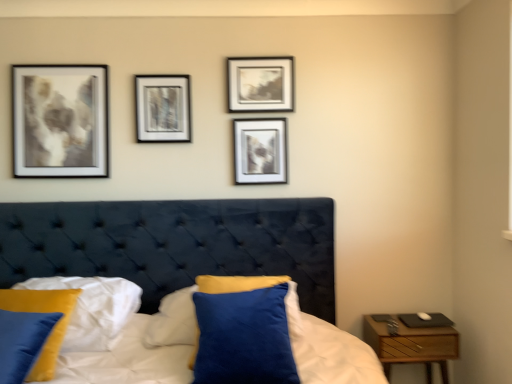
Where is `matte silver picture frame at upper center, marked as the 2th picture frame in a left-to-right arrangement`? matte silver picture frame at upper center, marked as the 2th picture frame in a left-to-right arrangement is located at coordinates (260, 151).

Measure the distance between velvet blue pillow at lower left, positioned as the first pillow in left-to-right order, and camera.

The distance of velvet blue pillow at lower left, positioned as the first pillow in left-to-right order, from camera is 1.52 meters.

You are a GUI agent. You are given a task and a screenshot of the screen. Output one action in this format:
    pyautogui.click(x=<x>, y=<y>)
    Task: Click on the matte silver picture frame at upper center, marked as the 2th picture frame in a left-to-right arrangement
    Image resolution: width=512 pixels, height=384 pixels.
    Given the screenshot: What is the action you would take?
    pyautogui.click(x=260, y=151)

Is point (141, 84) farther from camera compared to point (285, 101)?

No, (141, 84) is closer to viewer.

Is the position of metallic silver frame at center, the first picture frame when ordered from left to right, more distant than that of matte black picture frame at upper center, which is the 1th picture frame in right-to-left order?

No, metallic silver frame at center, the first picture frame when ordered from left to right, is in front of matte black picture frame at upper center, which is the 1th picture frame in right-to-left order.

Considering the relative positions of metallic silver frame at center, the 3th picture frame in the right-to-left sequence, and matte black picture frame at upper center, positioned as the 3th picture frame in left-to-right order, in the image provided, is metallic silver frame at center, the 3th picture frame in the right-to-left sequence, to the left of matte black picture frame at upper center, positioned as the 3th picture frame in left-to-right order, from the viewer's perspective?

Correct, you'll find metallic silver frame at center, the 3th picture frame in the right-to-left sequence, to the left of matte black picture frame at upper center, positioned as the 3th picture frame in left-to-right order.

Can you confirm if metallic silver frame at center, the first picture frame when ordered from left to right, is wider than matte black picture frame at upper center, which is the 1th picture frame in right-to-left order?

No, metallic silver frame at center, the first picture frame when ordered from left to right, is not wider than matte black picture frame at upper center, which is the 1th picture frame in right-to-left order.

Which is in front, point (159, 123) or point (402, 362)?

The point (402, 362) is closer.

Can we say metallic silver frame at center, the first picture frame when ordered from left to right, lies outside wooden nightstand at right?

metallic silver frame at center, the first picture frame when ordered from left to right, lies outside wooden nightstand at right's area.

From the image's perspective, would you say metallic silver frame at center, the 3th picture frame in the right-to-left sequence, is positioned over wooden nightstand at right?

Correct, metallic silver frame at center, the 3th picture frame in the right-to-left sequence, appears higher than wooden nightstand at right in the image.

Between metallic silver frame at center, the 3th picture frame in the right-to-left sequence, and wooden nightstand at right, which one has smaller width?

Thinner between the two is metallic silver frame at center, the 3th picture frame in the right-to-left sequence.

Is point (54, 290) behind point (269, 121)?

No, it is not.

Can you tell me how much velvet blue pillow at lower left, positioned as the first pillow in left-to-right order, and matte silver picture frame at upper center, the 2th picture frame positioned from the right, differ in facing direction?

There is a 2.05-degree angle between the facing directions of velvet blue pillow at lower left, positioned as the first pillow in left-to-right order, and matte silver picture frame at upper center, the 2th picture frame positioned from the right.

Who is smaller, velvet blue pillow at lower left, which appears as the 2th pillow when viewed from the right, or matte silver picture frame at upper center, marked as the 2th picture frame in a left-to-right arrangement?

matte silver picture frame at upper center, marked as the 2th picture frame in a left-to-right arrangement, is smaller.

Would you say velvet blue pillow at lower left, which appears as the 2th pillow when viewed from the right, is a long distance from matte silver picture frame at upper center, marked as the 2th picture frame in a left-to-right arrangement?

Yes.

Does matte black picture frame at upper center, which is the 1th picture frame in right-to-left order, have a greater width compared to wooden nightstand at right?

In fact, matte black picture frame at upper center, which is the 1th picture frame in right-to-left order, might be narrower than wooden nightstand at right.

Is matte black picture frame at upper center, positioned as the 3th picture frame in left-to-right order, at the right side of wooden nightstand at right?

No, matte black picture frame at upper center, positioned as the 3th picture frame in left-to-right order, is not to the right of wooden nightstand at right.

Image resolution: width=512 pixels, height=384 pixels. Find the location of `nightstand that is under the matte black picture frame at upper center, which is the 1th picture frame in right-to-left order (from a real-world perspective)`. nightstand that is under the matte black picture frame at upper center, which is the 1th picture frame in right-to-left order (from a real-world perspective) is located at coordinates (412, 345).

Is metallic silver frame at center, the 3th picture frame in the right-to-left sequence, facing away from matte silver picture frame at upper center, the 2th picture frame positioned from the right?

No.

Which object is positioned more to the right, metallic silver frame at center, the 3th picture frame in the right-to-left sequence, or matte silver picture frame at upper center, the 2th picture frame positioned from the right?

matte silver picture frame at upper center, the 2th picture frame positioned from the right.

Which object is further away from the camera taking this photo, metallic silver frame at center, the first picture frame when ordered from left to right, or matte silver picture frame at upper center, the 2th picture frame positioned from the right?

Positioned behind is matte silver picture frame at upper center, the 2th picture frame positioned from the right.

Is the position of matte black picture frame at upper center, which is the 1th picture frame in right-to-left order, less distant than that of matte silver picture frame at upper center, marked as the 2th picture frame in a left-to-right arrangement?

Yes, it is.

Does matte black picture frame at upper center, positioned as the 3th picture frame in left-to-right order, appear on the right side of matte silver picture frame at upper center, the 2th picture frame positioned from the right?

Correct, you'll find matte black picture frame at upper center, positioned as the 3th picture frame in left-to-right order, to the right of matte silver picture frame at upper center, the 2th picture frame positioned from the right.

In terms of width, does matte black picture frame at upper center, which is the 1th picture frame in right-to-left order, look wider or thinner when compared to matte silver picture frame at upper center, marked as the 2th picture frame in a left-to-right arrangement?

Clearly, matte black picture frame at upper center, which is the 1th picture frame in right-to-left order, has more width compared to matte silver picture frame at upper center, marked as the 2th picture frame in a left-to-right arrangement.

From a real-world perspective, is matte black picture frame at upper center, which is the 1th picture frame in right-to-left order, physically located above or below matte silver picture frame at upper center, the 2th picture frame positioned from the right?

matte black picture frame at upper center, which is the 1th picture frame in right-to-left order, is above matte silver picture frame at upper center, the 2th picture frame positioned from the right.

You are a GUI agent. You are given a task and a screenshot of the screen. Output one action in this format:
    pyautogui.click(x=<x>, y=<y>)
    Task: Click on the 1st picture frame directly above the velvet blue pillow at lower left, positioned as the first pillow in left-to-right order (from a real-world perspective)
    The image size is (512, 384).
    Given the screenshot: What is the action you would take?
    pyautogui.click(x=260, y=151)

Is matte silver picture frame at upper center, marked as the 2th picture frame in a left-to-right arrangement, far from velvet blue pillow at lower left, which appears as the 2th pillow when viewed from the right?

Yes, matte silver picture frame at upper center, marked as the 2th picture frame in a left-to-right arrangement, and velvet blue pillow at lower left, which appears as the 2th pillow when viewed from the right, are quite far apart.

Does matte silver picture frame at upper center, the 2th picture frame positioned from the right, lie behind velvet blue pillow at lower left, positioned as the first pillow in left-to-right order?

Yes.

Does point (246, 139) appear closer or farther from the camera than point (35, 293)?

Point (246, 139) appears to be farther away from the viewer than point (35, 293).

Where is `the 1st picture frame below the matte black picture frame at upper center, positioned as the 3th picture frame in left-to-right order (from the image's perspective)`? The image size is (512, 384). the 1st picture frame below the matte black picture frame at upper center, positioned as the 3th picture frame in left-to-right order (from the image's perspective) is located at coordinates (163, 108).

Where is `nightstand below the metallic silver frame at center, the 3th picture frame in the right-to-left sequence (from a real-world perspective)`? This screenshot has width=512, height=384. nightstand below the metallic silver frame at center, the 3th picture frame in the right-to-left sequence (from a real-world perspective) is located at coordinates (412, 345).

Estimate the real-world distances between objects in this image. Which object is further from matte silver picture frame at upper center, the 2th picture frame positioned from the right, matte black picture frame at upper center, positioned as the 3th picture frame in left-to-right order, or metallic silver frame at center, the 3th picture frame in the right-to-left sequence?

metallic silver frame at center, the 3th picture frame in the right-to-left sequence, is positioned further to the anchor matte silver picture frame at upper center, the 2th picture frame positioned from the right.

Considering their positions, is matte silver picture frame at upper center, the 2th picture frame positioned from the right, positioned closer to velvet blue pillow at lower left, which appears as the 2th pillow when viewed from the right, than metallic silver frame at center, the 3th picture frame in the right-to-left sequence?

metallic silver frame at center, the 3th picture frame in the right-to-left sequence.

From the image, which object appears to be farther from wooden nightstand at right, velvet blue pillow at lower left, which appears as the 2th pillow when viewed from the right, or metallic silver frame at center, the first picture frame when ordered from left to right?

The object further to wooden nightstand at right is metallic silver frame at center, the first picture frame when ordered from left to right.

From the image, which object appears to be nearer to matte silver picture frame at upper center, the 2th picture frame positioned from the right, wooden nightstand at right or matte black picture frame at upper center, positioned as the 3th picture frame in left-to-right order?

matte black picture frame at upper center, positioned as the 3th picture frame in left-to-right order.

Based on their spatial positions, is metallic silver frame at center, the first picture frame when ordered from left to right, or wooden nightstand at right closer to matte black picture frame at upper center, positioned as the 3th picture frame in left-to-right order?

metallic silver frame at center, the first picture frame when ordered from left to right, is closer to matte black picture frame at upper center, positioned as the 3th picture frame in left-to-right order.

When comparing their distances from matte black picture frame at upper center, positioned as the 3th picture frame in left-to-right order, does wooden nightstand at right or velvet blue pillow at lower left, positioned as the first pillow in left-to-right order, seem further?

wooden nightstand at right lies further to matte black picture frame at upper center, positioned as the 3th picture frame in left-to-right order, than the other object.

Based on their spatial positions, is velvet blue pillow at lower left, positioned as the first pillow in left-to-right order, or wooden nightstand at right further from matte black picture frame at upper center, which is the 1th picture frame in right-to-left order?

wooden nightstand at right.

Estimate the real-world distances between objects in this image. Which object is further from metallic silver frame at center, the first picture frame when ordered from left to right, matte silver picture frame at upper center, the 2th picture frame positioned from the right, or wooden nightstand at right?

wooden nightstand at right is further to metallic silver frame at center, the first picture frame when ordered from left to right.

At what (x,y) coordinates should I click in order to perform the action: click on pillow between velvet blue pillow at lower left, positioned as the first pillow in left-to-right order, and matte silver picture frame at upper center, the 2th picture frame positioned from the right, in the front-back direction. Please return your answer as a coordinate pair (x, y). Looking at the image, I should click on (211, 293).

At what (x,y) coordinates should I click in order to perform the action: click on pillow between matte black picture frame at upper center, which is the 1th picture frame in right-to-left order, and velvet blue pillow at lower left, positioned as the first pillow in left-to-right order, in the vertical direction. Please return your answer as a coordinate pair (x, y). Image resolution: width=512 pixels, height=384 pixels. Looking at the image, I should click on (211, 293).

At what (x,y) coordinates should I click in order to perform the action: click on picture frame between metallic silver frame at center, the first picture frame when ordered from left to right, and matte black picture frame at upper center, which is the 1th picture frame in right-to-left order, from left to right. Please return your answer as a coordinate pair (x, y). The width and height of the screenshot is (512, 384). Looking at the image, I should click on (260, 151).

The width and height of the screenshot is (512, 384). I want to click on pillow that lies between metallic silver frame at center, the first picture frame when ordered from left to right, and velvet blue pillow at lower left, positioned as the first pillow in left-to-right order, from top to bottom, so click(x=211, y=293).